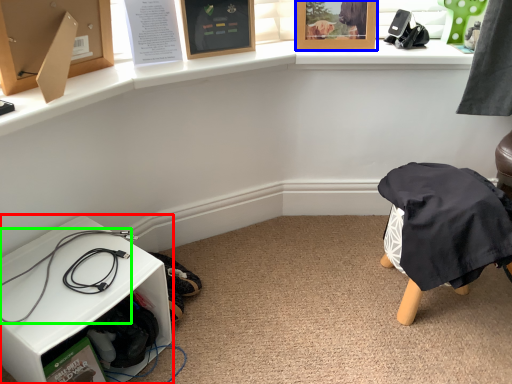
Question: Which object is positioned farthest from furniture (highlighted by a red box)? Select from picture frame (highlighted by a blue box) and wire (highlighted by a green box).

Choices:
 (A) picture frame
 (B) wire

Answer: (A)